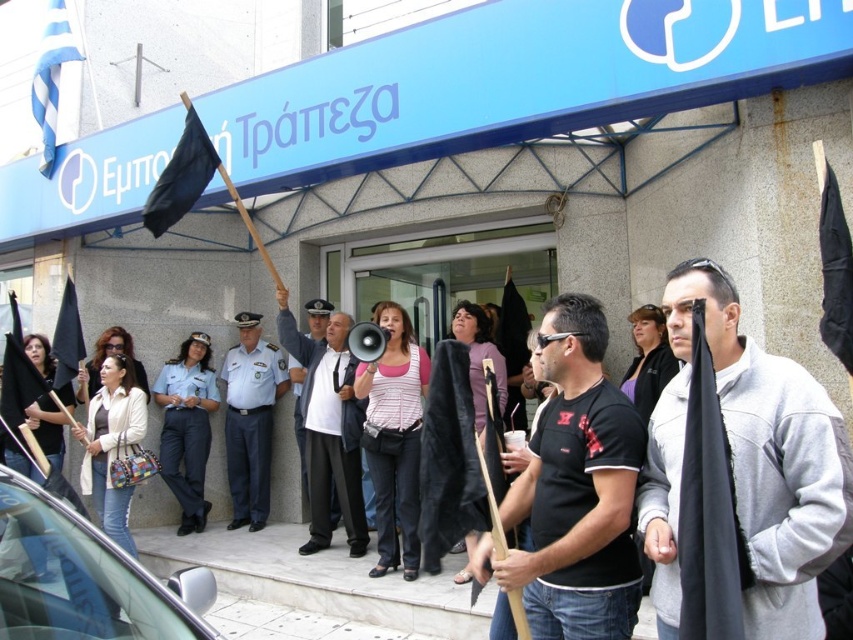
You are a journalist reporting on the protest outside the Seven Month Bank. You notice a light blue uniform at center and a black fabric flag at upper left. Which object is positioned to the left of the other?

The light blue uniform at center is positioned on the left side of black fabric flag at upper left.

You are a photographer standing at the edge of the crowd. You want to take a photo that captures both the black matte shirt at center and the light blue uniform at center in the same frame. Which object should you focus on first to ensure both are in focus?

The black matte shirt at center is shorter than the light blue uniform at center. To ensure both are in focus, you should focus on the light blue uniform at center first, as it is farther away, and adjust the depth of field accordingly.